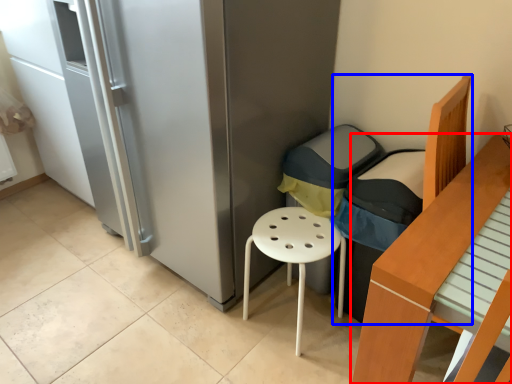
Question: Which of the following is the farthest to the observer, furniture (highlighted by a red box) or armchair (highlighted by a blue box)?

Choices:
 (A) furniture
 (B) armchair

Answer: (B)